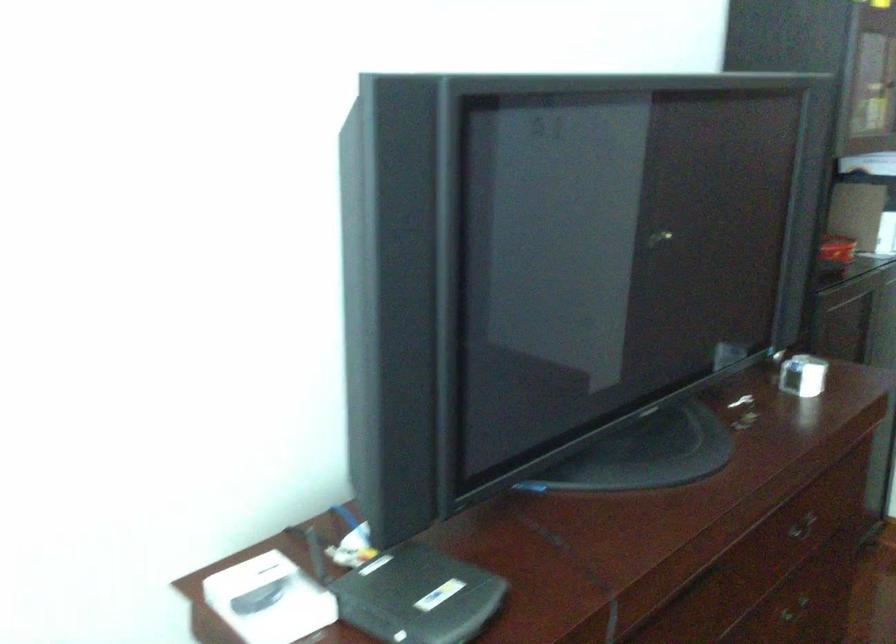
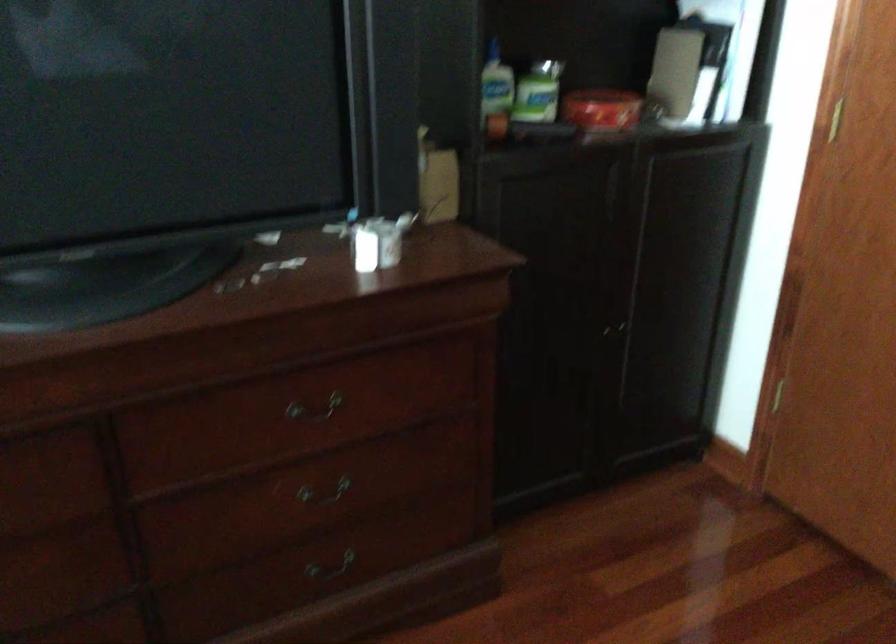
In the second image, find the point that corresponds to point (779, 536) in the first image.

(314, 409)